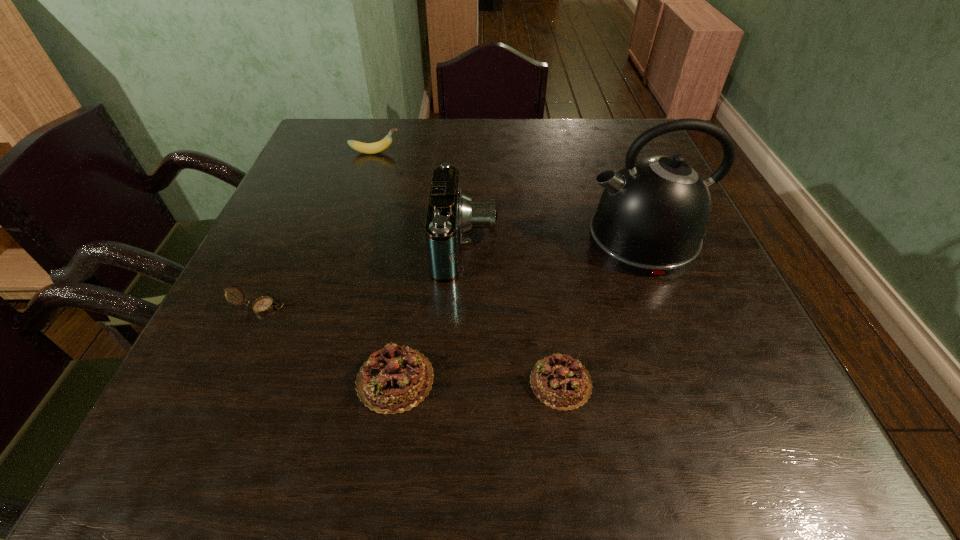
Where is `the left chocolate cake`? the left chocolate cake is located at coordinates (395, 379).

Locate an element on the screen. This screenshot has height=540, width=960. the right chocolate cake is located at coordinates (559, 381).

The width and height of the screenshot is (960, 540). I want to click on the shorter chocolate cake, so click(559, 381).

You are a GUI agent. You are given a task and a screenshot of the screen. Output one action in this format:
    pyautogui.click(x=<x>, y=<y>)
    Task: Click on the farthest object
    Image resolution: width=960 pixels, height=540 pixels.
    Given the screenshot: What is the action you would take?
    pyautogui.click(x=367, y=148)

The width and height of the screenshot is (960, 540). What are the coordinates of `the fourth shortest object` in the screenshot? It's located at (367, 148).

Identify the location of the rightmost object. This screenshot has width=960, height=540. (652, 215).

You are a GUI agent. You are given a task and a screenshot of the screen. Output one action in this format:
    pyautogui.click(x=<x>, y=<y>)
    Task: Click on the kettle
    The height and width of the screenshot is (540, 960).
    Given the screenshot: What is the action you would take?
    652,215

The image size is (960, 540). I want to click on the leftmost object, so coord(263,305).

You are a GUI agent. You are given a task and a screenshot of the screen. Output one action in this format:
    pyautogui.click(x=<x>, y=<y>)
    Task: Click on the third nearest object
    The width and height of the screenshot is (960, 540).
    Given the screenshot: What is the action you would take?
    pyautogui.click(x=263, y=305)

Locate an element on the screen. camcorder is located at coordinates (450, 215).